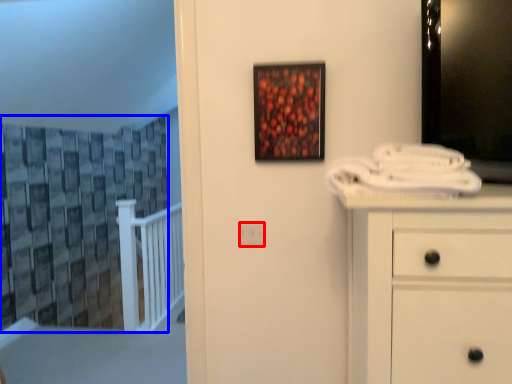
Question: Which of the following is the farthest to the observer, electric outlet (highlighted by a red box) or curtain (highlighted by a blue box)?

Choices:
 (A) electric outlet
 (B) curtain

Answer: (A)